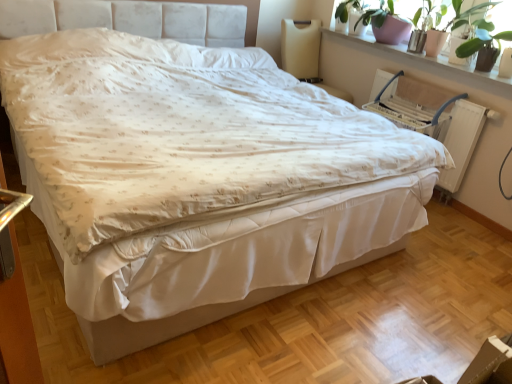
The height and width of the screenshot is (384, 512). In order to click on beige fabric swivel chair at upper right in this screenshot , I will do `click(305, 53)`.

The height and width of the screenshot is (384, 512). What do you see at coordinates (426, 59) in the screenshot?
I see `white wood window sill at upper right` at bounding box center [426, 59].

This screenshot has height=384, width=512. I want to click on green glossy plant at upper right, the 2th plant positioned from the front, so click(464, 23).

Who is shorter, green leafy plant at upper right, the 2th plant viewed from the back, or beige fabric swivel chair at upper right?

green leafy plant at upper right, the 2th plant viewed from the back.

Are green leafy plant at upper right, the first plant in the front-to-back sequence, and beige fabric swivel chair at upper right far apart?

Yes, green leafy plant at upper right, the first plant in the front-to-back sequence, and beige fabric swivel chair at upper right are located far from each other.

Is beige fabric swivel chair at upper right inside green leafy plant at upper right, the first plant in the front-to-back sequence?

No, green leafy plant at upper right, the first plant in the front-to-back sequence, does not contain beige fabric swivel chair at upper right.

How much distance is there between green leafy plant at upper right, the first plant in the front-to-back sequence, and beige fabric swivel chair at upper right?

The distance of green leafy plant at upper right, the first plant in the front-to-back sequence, from beige fabric swivel chair at upper right is 4.06 feet.

Does green leafy plant at upper right, the first plant in the front-to-back sequence, have a larger size compared to green glossy plant at upper right, which is the first plant in back-to-front order?

Incorrect, green leafy plant at upper right, the first plant in the front-to-back sequence, is not larger than green glossy plant at upper right, which is the first plant in back-to-front order.

Is green leafy plant at upper right, the 2th plant viewed from the back, in front of green glossy plant at upper right, which is the first plant in back-to-front order?

Yes, it is.

Is green leafy plant at upper right, the first plant in the front-to-back sequence, taller than green glossy plant at upper right, which is the first plant in back-to-front order?

No, green leafy plant at upper right, the first plant in the front-to-back sequence, is not taller than green glossy plant at upper right, which is the first plant in back-to-front order.

From the image's perspective, does green leafy plant at upper right, the first plant in the front-to-back sequence, appear lower than white wood window sill at upper right?

Correct, green leafy plant at upper right, the first plant in the front-to-back sequence, appears lower than white wood window sill at upper right in the image.

Which is in front, point (471, 40) or point (489, 77)?

The point (489, 77) is closer.

The image size is (512, 384). Find the location of `window sill behind the green leafy plant at upper right, the 2th plant viewed from the back`. window sill behind the green leafy plant at upper right, the 2th plant viewed from the back is located at coordinates (426, 59).

Is white wood window sill at upper right facing towards green leafy plant at upper right, the 2th plant viewed from the back?

No, white wood window sill at upper right does not turn towards green leafy plant at upper right, the 2th plant viewed from the back.

Measure the distance from white wood window sill at upper right to green leafy plant at upper right, the 2th plant viewed from the back.

A distance of 8.78 inches exists between white wood window sill at upper right and green leafy plant at upper right, the 2th plant viewed from the back.

Do you think white wood window sill at upper right is within green leafy plant at upper right, the first plant in the front-to-back sequence, or outside of it?

white wood window sill at upper right is located beyond the bounds of green leafy plant at upper right, the first plant in the front-to-back sequence.

Starting from the white wood window sill at upper right, which plant is the 2nd one to the right? Please provide its 2D coordinates.

[(482, 39)]

Does white wood window sill at upper right have a lesser width compared to green glossy plant at upper right, the 2th plant positioned from the front?

In fact, white wood window sill at upper right might be wider than green glossy plant at upper right, the 2th plant positioned from the front.

Considering the positions of points (490, 73) and (473, 49), is point (490, 73) closer to camera compared to point (473, 49)?

That is True.

The image size is (512, 384). I want to click on plant behind the white wood window sill at upper right, so click(464, 23).

Consider the image. Considering the relative positions of white wood window sill at upper right and green glossy plant at upper right, which is the first plant in back-to-front order, in the image provided, is white wood window sill at upper right to the left of green glossy plant at upper right, which is the first plant in back-to-front order, from the viewer's perspective?

Indeed, white wood window sill at upper right is positioned on the left side of green glossy plant at upper right, which is the first plant in back-to-front order.

Which object is closer to the camera, green glossy plant at upper right, which is the first plant in back-to-front order, or white wood window sill at upper right?

white wood window sill at upper right is closer to the camera.

Would you consider green glossy plant at upper right, the 2th plant positioned from the front, to be distant from white wood window sill at upper right?

No.

Is green glossy plant at upper right, the 2th plant positioned from the front, facing towards white wood window sill at upper right?

No.

Consider the image. Considering the relative sizes of green glossy plant at upper right, which is the first plant in back-to-front order, and white wood window sill at upper right in the image provided, is green glossy plant at upper right, which is the first plant in back-to-front order, thinner than white wood window sill at upper right?

Yes.

Considering the points (343, 6) and (509, 35), which point is behind, point (343, 6) or point (509, 35)?

The point (343, 6) is more distant.

Is green glossy plant at upper right, which is the first plant in back-to-front order, touching green leafy plant at upper right, the 2th plant viewed from the back?

Yes, green glossy plant at upper right, which is the first plant in back-to-front order, and green leafy plant at upper right, the 2th plant viewed from the back, clearly make contact.

From a real-world perspective, which is physically below, green glossy plant at upper right, the 2th plant positioned from the front, or green leafy plant at upper right, the first plant in the front-to-back sequence?

From a 3D spatial view, green leafy plant at upper right, the first plant in the front-to-back sequence, is below.

Can green leafy plant at upper right, the 2th plant viewed from the back, be found inside green glossy plant at upper right, which is the first plant in back-to-front order?

No, green leafy plant at upper right, the 2th plant viewed from the back, is not surrounded by green glossy plant at upper right, which is the first plant in back-to-front order.

Locate an element on the screen. The width and height of the screenshot is (512, 384). swivel chair to the left of green leafy plant at upper right, the 2th plant viewed from the back is located at coordinates pos(305,53).

The image size is (512, 384). I want to click on plant on the right of green glossy plant at upper right, the 2th plant positioned from the front, so click(x=482, y=39).

Looking at this image, considering their positions, is beige fabric swivel chair at upper right positioned closer to white wood window sill at upper right than green leafy plant at upper right, the first plant in the front-to-back sequence?

Based on the image, green leafy plant at upper right, the first plant in the front-to-back sequence, appears to be nearer to white wood window sill at upper right.

Looking at the image, which one is located closer to green glossy plant at upper right, which is the first plant in back-to-front order, white wood window sill at upper right or beige fabric swivel chair at upper right?

white wood window sill at upper right lies closer to green glossy plant at upper right, which is the first plant in back-to-front order, than the other object.

Looking at this image, from the image, which object appears to be farther from white wood window sill at upper right, green leafy plant at upper right, the 2th plant viewed from the back, or green glossy plant at upper right, the 2th plant positioned from the front?

The object further to white wood window sill at upper right is green glossy plant at upper right, the 2th plant positioned from the front.

Which object lies further to the anchor point beige fabric swivel chair at upper right, green glossy plant at upper right, which is the first plant in back-to-front order, or green leafy plant at upper right, the 2th plant viewed from the back?

green leafy plant at upper right, the 2th plant viewed from the back, is further to beige fabric swivel chair at upper right.

When comparing their distances from green glossy plant at upper right, the 2th plant positioned from the front, does beige fabric swivel chair at upper right or green leafy plant at upper right, the 2th plant viewed from the back, seem closer?

green leafy plant at upper right, the 2th plant viewed from the back.

When comparing their distances from green glossy plant at upper right, which is the first plant in back-to-front order, does green leafy plant at upper right, the first plant in the front-to-back sequence, or beige fabric swivel chair at upper right seem closer?

The object closer to green glossy plant at upper right, which is the first plant in back-to-front order, is green leafy plant at upper right, the first plant in the front-to-back sequence.

Looking at the image, which one is located closer to white wood window sill at upper right, green glossy plant at upper right, which is the first plant in back-to-front order, or green leafy plant at upper right, the 2th plant viewed from the back?

green leafy plant at upper right, the 2th plant viewed from the back.

Which object lies nearer to the anchor point green leafy plant at upper right, the 2th plant viewed from the back, green glossy plant at upper right, the 2th plant positioned from the front, or beige fabric swivel chair at upper right?

green glossy plant at upper right, the 2th plant positioned from the front.

At what (x,y) coordinates should I click in order to perform the action: click on plant located between white wood window sill at upper right and green leafy plant at upper right, the 2th plant viewed from the back, in the left-right direction. Please return your answer as a coordinate pair (x, y). The width and height of the screenshot is (512, 384). Looking at the image, I should click on (464, 23).

Locate an element on the screen. The width and height of the screenshot is (512, 384). window sill between beige fabric swivel chair at upper right and green leafy plant at upper right, the 2th plant viewed from the back, from left to right is located at coordinates (426, 59).

This screenshot has height=384, width=512. Identify the location of window sill located between beige fabric swivel chair at upper right and green glossy plant at upper right, which is the first plant in back-to-front order, in the left-right direction. point(426,59).

Where is `plant between beige fabric swivel chair at upper right and green leafy plant at upper right, the first plant in the front-to-back sequence, from left to right`? plant between beige fabric swivel chair at upper right and green leafy plant at upper right, the first plant in the front-to-back sequence, from left to right is located at coordinates (464, 23).